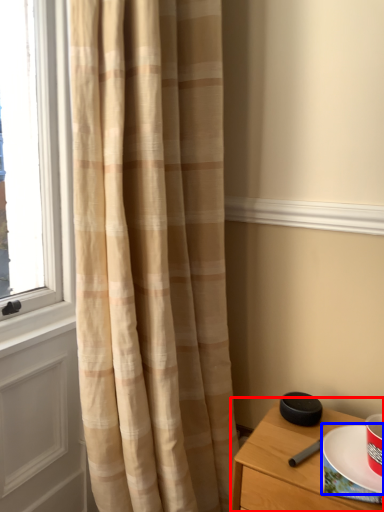
Question: Which of the following is the farthest to the observer, nightstand (highlighted by a red box) or paper plate (highlighted by a blue box)?

Choices:
 (A) nightstand
 (B) paper plate

Answer: (B)